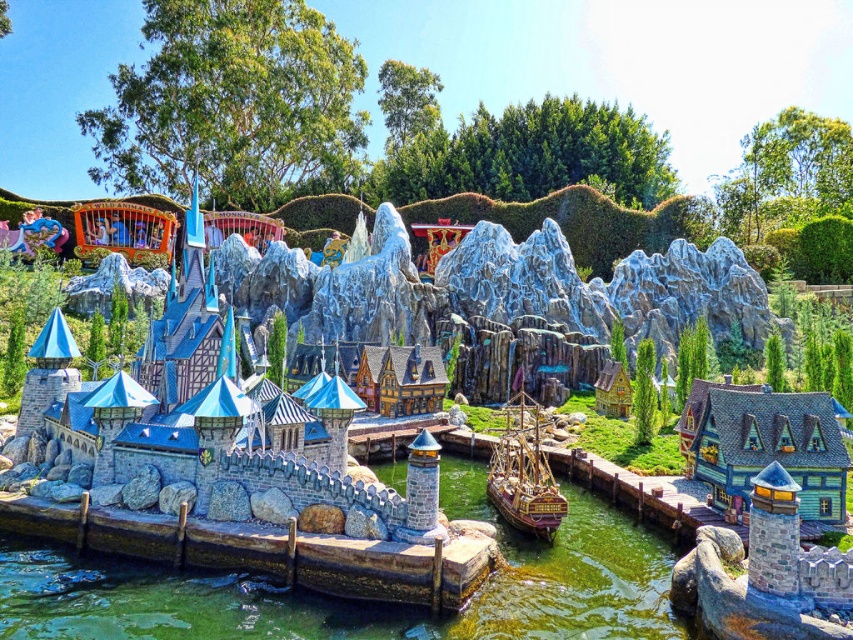
Question: Can you confirm if clear glass water at center is wider than wooden house at right?

Choices:
 (A) yes
 (B) no

Answer: (A)

Question: Can you confirm if wooden house at right is positioned to the left of wooden ship at lower center?

Choices:
 (A) yes
 (B) no

Answer: (B)

Question: Which of the following is the closest to the observer?

Choices:
 (A) (685, 432)
 (B) (213, 627)
 (C) (514, 486)

Answer: (B)

Question: Is wooden house at right further to camera compared to wooden ship at lower center?

Choices:
 (A) yes
 (B) no

Answer: (B)

Question: Which of these objects is positioned closest to the wooden house at right?

Choices:
 (A) clear glass water at center
 (B) wooden ship at lower center

Answer: (A)

Question: Which point is farther from the camera taking this photo?

Choices:
 (A) (534, 452)
 (B) (692, 467)
 (C) (590, 621)

Answer: (B)